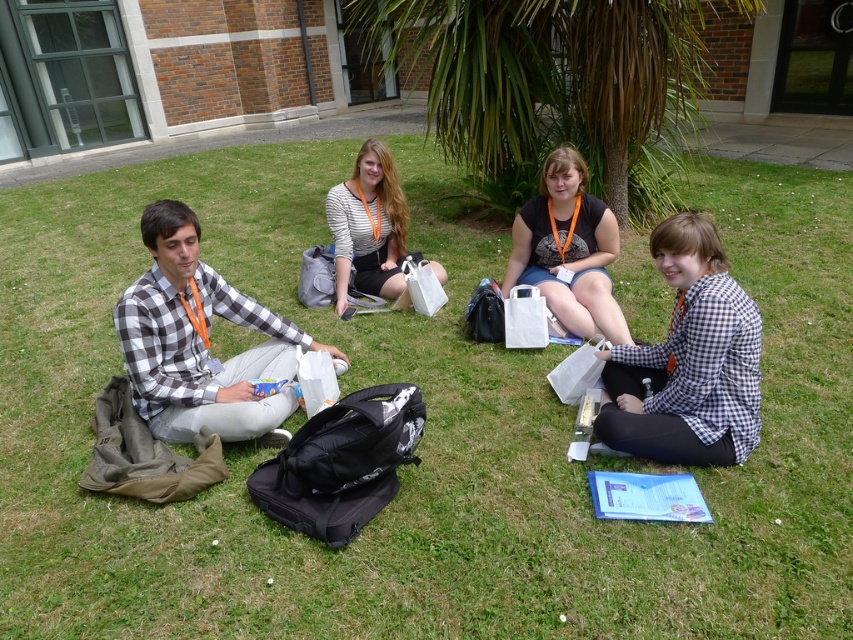
Is checkered fabric shirt at left closer to the viewer compared to camouflage t-shirt at center?

That is True.

Does point (218, 387) come closer to viewer compared to point (589, 211)?

Yes, point (218, 387) is in front of point (589, 211).

Who is more distant from viewer, (258, 305) or (569, 148)?

Point (569, 148)

The width and height of the screenshot is (853, 640). Find the location of `checkered fabric shirt at left`. checkered fabric shirt at left is located at coordinates (200, 342).

Is point (606, 212) farther from camera compared to point (364, 228)?

That is False.

Is camouflage t-shirt at center thinner than striped cotton shirt at center?

Yes, camouflage t-shirt at center is thinner than striped cotton shirt at center.

Who is more distant from viewer, [548,266] or [370,257]?

Point [370,257]

At what (x,y) coordinates should I click in order to perform the action: click on camouflage t-shirt at center. Please return your answer as a coordinate pair (x, y). The height and width of the screenshot is (640, 853). Looking at the image, I should click on (567, 250).

Who is positioned more to the left, checkered fabric shirt at left or striped cotton shirt at center?

A: checkered fabric shirt at left is more to the left.

Between checkered fabric shirt at left and striped cotton shirt at center, which one is positioned higher?

striped cotton shirt at center is above.

Find the location of a particular element. checkered fabric shirt at left is located at coordinates (200, 342).